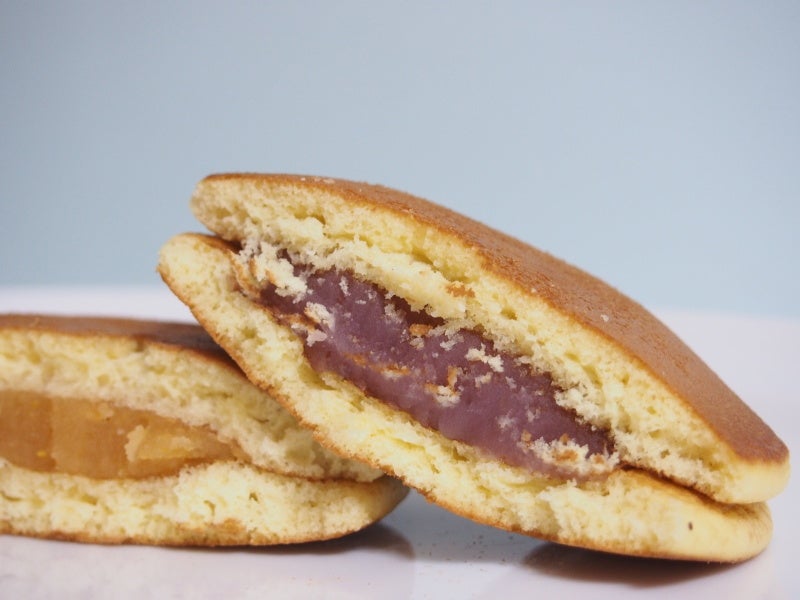
The image size is (800, 600). I want to click on shiny table, so click(x=450, y=569).